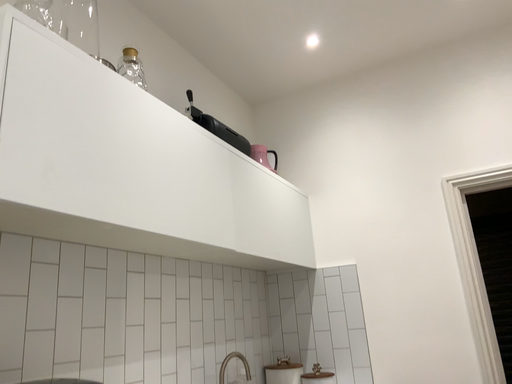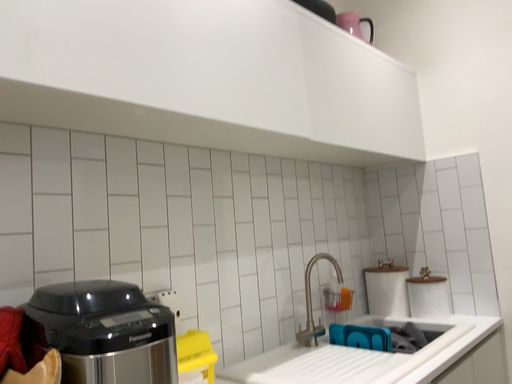
Question: Which way did the camera rotate in the video?

Choices:
 (A) rotated upward
 (B) rotated downward

Answer: (B)